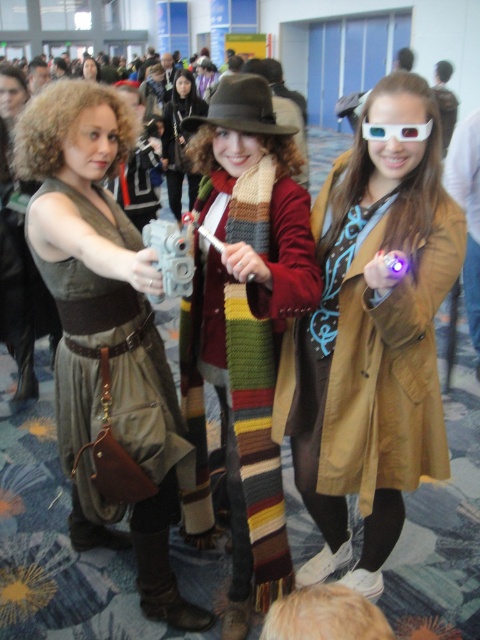
You are a photographer at the event and need to capture a photo that includes both the transparent plastic goggles at center and the matte black dress at center. The camera you have can focus on objects within a 30 feet range. Will you be able to capture both items in a single focused shot?

The distance between the transparent plastic goggles at center and the matte black dress at center is 31.55 feet, which exceeds the camera focus range of 30 feet. Therefore, you cannot capture both items in a single focused shot.

You are a photographer at the convention and need to capture a closeup of the transparent plastic goggles at center. Given that your camera can only focus on objects within a 0.15 unit radius from the center point, will the goggles be in focus?

The transparent plastic goggles at center are located at point (396,131). The distance from the center point is sqrt0.206 squared plus 0.827 squared, which is approximately sqrt0.0424 plus 0.684, totaling sqrt0.7264 equals 0.852 units. Since 0.852 is greater than 0.15, the goggles will not be in focus.